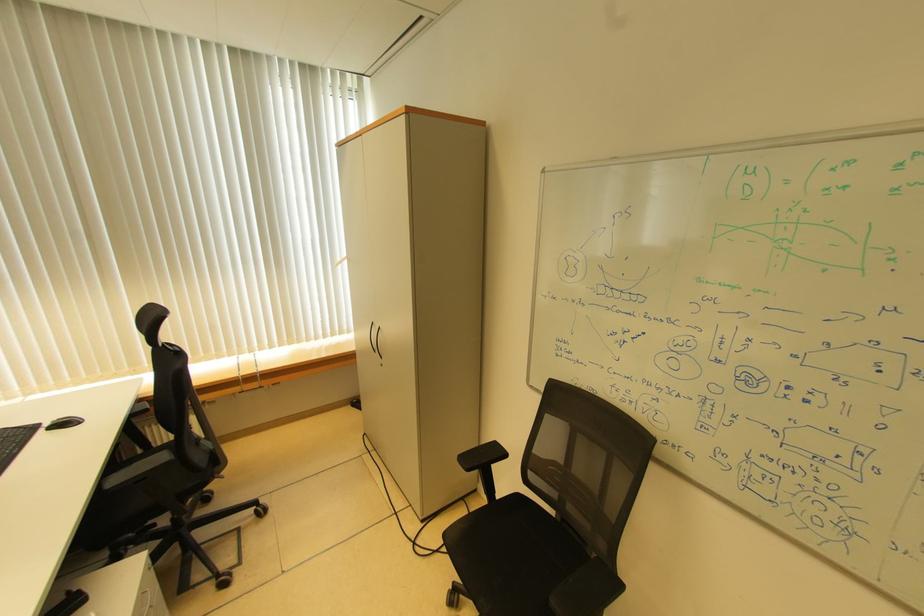
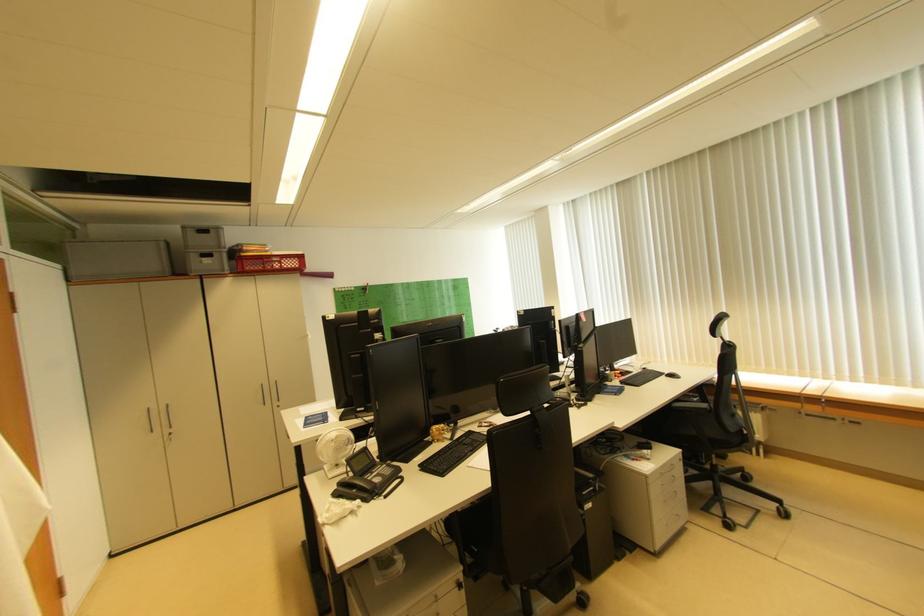
Question: The camera is either moving clockwise (left) or counter-clockwise (right) around the object. The first image is from the beginning of the video and the second image is from the end. Is the camera moving left or right when shooting the video?

Choices:
 (A) Left
 (B) Right

Answer: (B)